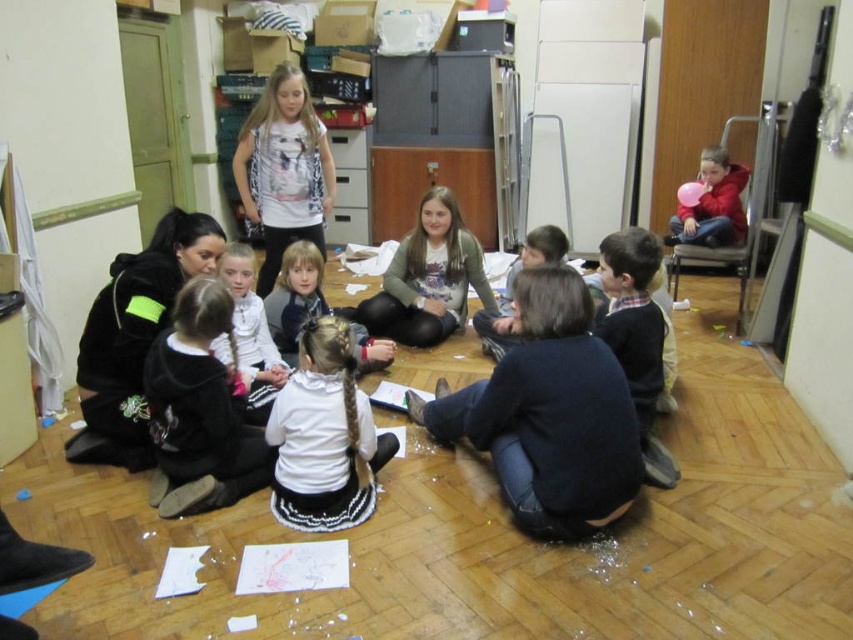
Question: Which object appears farthest from the camera in this image?

Choices:
 (A) white printed shirt at center
 (B) light brown hair at center
 (C) white matte shirt at center

Answer: (B)

Question: Which of these objects is positioned closest to the white printed shirt at center?

Choices:
 (A) white matte shirt at center
 (B) black fuzzy sweater at lower left

Answer: (B)

Question: In this image, where is dark blue sweater at center located relative to white matte shirt at center?

Choices:
 (A) left
 (B) right

Answer: (B)

Question: Is white matte dress at center thinner than red matte balloon at upper right?

Choices:
 (A) no
 (B) yes

Answer: (A)

Question: Does black fuzzy sweater at lower left have a lesser width compared to white printed shirt at center?

Choices:
 (A) no
 (B) yes

Answer: (B)

Question: Among these points, which one is farthest from the camera?

Choices:
 (A) (120, 324)
 (B) (209, 348)
 (C) (378, 362)

Answer: (C)